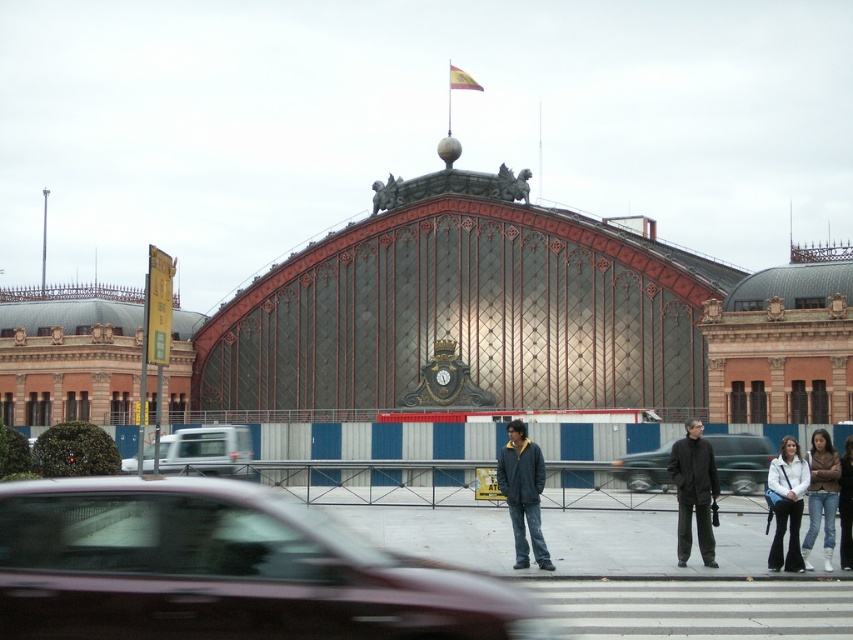
You are a photographer standing in front of the grand architectural structure described. You want to take a photo that includes both the metallic maroon sedan at center and the white leather jacket at lower right. Given their sizes, which object should you focus on to ensure both fit in the frame without cropping?

The metallic maroon sedan at center is larger than the white leather jacket at lower right, so you should focus on the metallic maroon sedan at center to ensure both objects fit in the frame without cropping.

You are standing at the entrance of the grand architectural structure and see a metallic maroon sedan at center and a white leather jacket at lower right. Which object is positioned to the left when facing the building?

The metallic maroon sedan at center is positioned to the left of the white leather jacket at lower right.